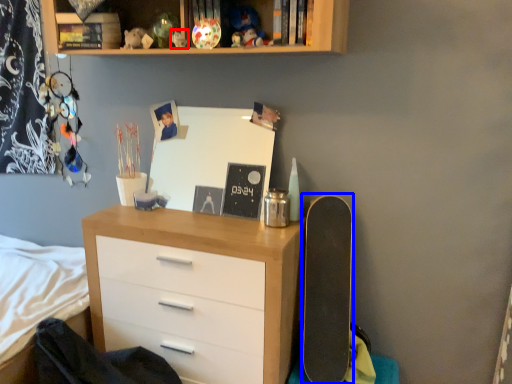
Question: Among these objects, which one is farthest to the camera, toy (highlighted by a red box) or skateboard (highlighted by a blue box)?

Choices:
 (A) toy
 (B) skateboard

Answer: (A)